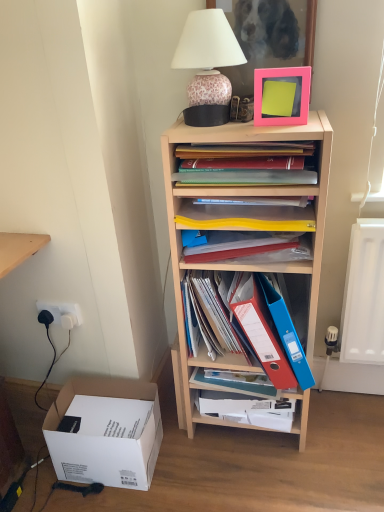
The image size is (384, 512). I want to click on vacant space in front of wooden shelf at center, so click(x=270, y=477).